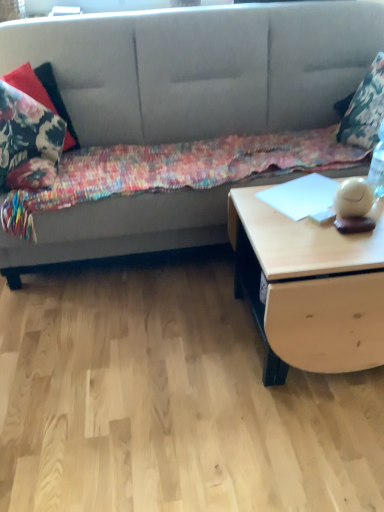
Where is `free point above light wood/texture table at right (from a real-world perspective)`? free point above light wood/texture table at right (from a real-world perspective) is located at coordinates (310, 220).